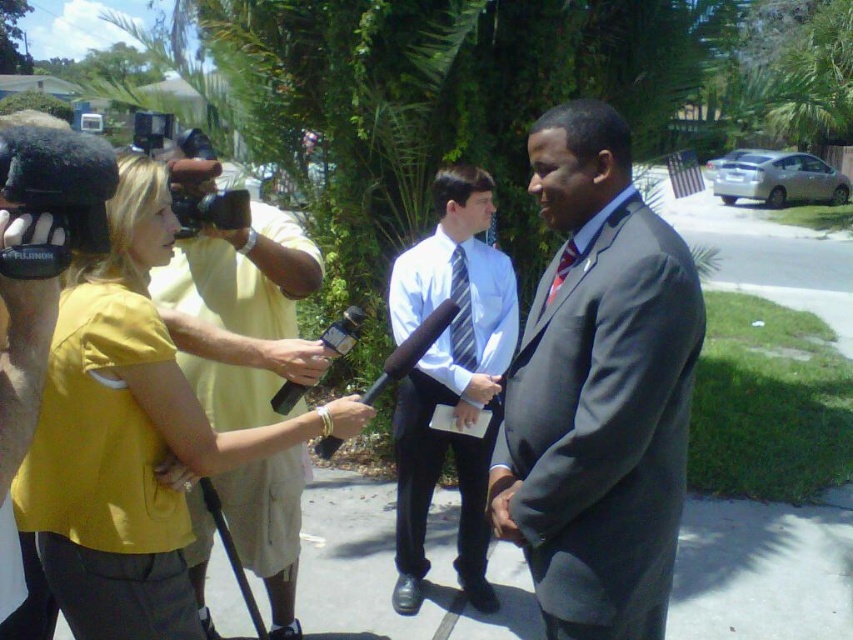
Locate an element on the screen. The image size is (853, 640). matte yellow shirt at center is located at coordinates (241, 314).

Is matte yellow shirt at center below striped fabric tie at center?

Yes, matte yellow shirt at center is below striped fabric tie at center.

Who is more forward, [218,413] or [457,364]?

Point [218,413] is in front.

At what (x,y) coordinates should I click in order to perform the action: click on matte yellow shirt at center. Please return your answer as a coordinate pair (x, y). The image size is (853, 640). Looking at the image, I should click on tap(241, 314).

Between dark gray suit at center and yellow fabric shirt at left, which one has less height?

yellow fabric shirt at left is shorter.

Between dark gray suit at center and yellow fabric shirt at left, which one is positioned higher?

dark gray suit at center is above.

Locate an element on the screen. dark gray suit at center is located at coordinates (598, 392).

Locate an element on the screen. Image resolution: width=853 pixels, height=640 pixels. dark gray suit at center is located at coordinates (598, 392).

Consider the image. Between yellow fabric shirt at left and matte yellow shirt at center, which one has more height?

matte yellow shirt at center is taller.

Based on the photo, which is more to the right, yellow fabric shirt at left or matte yellow shirt at center?

yellow fabric shirt at left is more to the right.

The width and height of the screenshot is (853, 640). In order to click on yellow fabric shirt at left in this screenshot , I will do `click(131, 436)`.